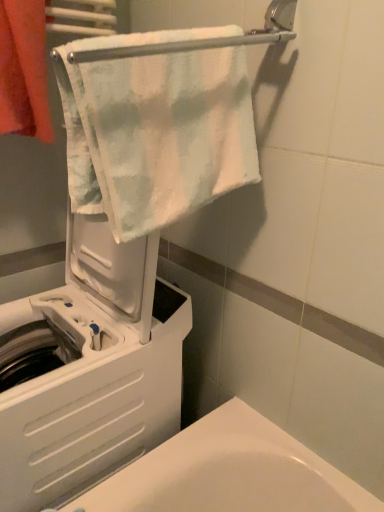
This screenshot has width=384, height=512. What do you see at coordinates (88, 369) in the screenshot?
I see `white plastic washing machine at left` at bounding box center [88, 369].

You are a GUI agent. You are given a task and a screenshot of the screen. Output one action in this format:
    pyautogui.click(x=<x>, y=<y>)
    Task: Click on the white soft towel at upper center, which is the first towel from right to left
    This screenshot has height=512, width=384.
    Given the screenshot: What is the action you would take?
    pyautogui.click(x=156, y=129)

Identify the location of orange cotton towel at upper left, marked as the second towel in a right-to-left arrangement. The width and height of the screenshot is (384, 512). (24, 70).

Relative to orange cotton towel at upper left, positioned as the 1th towel in left-to-right order, is white soft towel at upper center, which is the first towel from right to left, in front or behind?

Visually, white soft towel at upper center, which is the first towel from right to left, is located in front of orange cotton towel at upper left, positioned as the 1th towel in left-to-right order.

Who is smaller, white soft towel at upper center, placed as the second towel when sorted from left to right, or orange cotton towel at upper left, marked as the second towel in a right-to-left arrangement?

Smaller between the two is orange cotton towel at upper left, marked as the second towel in a right-to-left arrangement.

From the image's perspective, does white soft towel at upper center, which is the first towel from right to left, appear lower than orange cotton towel at upper left, positioned as the 1th towel in left-to-right order?

Yes, from the image's perspective, white soft towel at upper center, which is the first towel from right to left, is below orange cotton towel at upper left, positioned as the 1th towel in left-to-right order.

Is white soft towel at upper center, placed as the second towel when sorted from left to right, facing away from white plastic washing machine at left?

Yes, white soft towel at upper center, placed as the second towel when sorted from left to right, is facing away from white plastic washing machine at left.

Is there a large distance between white soft towel at upper center, placed as the second towel when sorted from left to right, and white plastic washing machine at left?

Actually, white soft towel at upper center, placed as the second towel when sorted from left to right, and white plastic washing machine at left are a little close together.

Is white soft towel at upper center, placed as the second towel when sorted from left to right, in front of or behind white plastic washing machine at left in the image?

Clearly, white soft towel at upper center, placed as the second towel when sorted from left to right, is in front of white plastic washing machine at left.

Is orange cotton towel at upper left, marked as the second towel in a right-to-left arrangement, far away from white soft towel at upper center, which is the first towel from right to left?

orange cotton towel at upper left, marked as the second towel in a right-to-left arrangement, is actually quite close to white soft towel at upper center, which is the first towel from right to left.

From a real-world perspective, is orange cotton towel at upper left, marked as the second towel in a right-to-left arrangement, positioned over white soft towel at upper center, which is the first towel from right to left, based on gravity?

Yes, from a real-world perspective, orange cotton towel at upper left, marked as the second towel in a right-to-left arrangement, is on top of white soft towel at upper center, which is the first towel from right to left.

At what (x,y) coordinates should I click in order to perform the action: click on towel above the white soft towel at upper center, which is the first towel from right to left (from a real-world perspective). Please return your answer as a coordinate pair (x, y). Looking at the image, I should click on (24, 70).

Could you tell me if orange cotton towel at upper left, marked as the second towel in a right-to-left arrangement, is facing white plastic washing machine at left?

No, orange cotton towel at upper left, marked as the second towel in a right-to-left arrangement, is not facing towards white plastic washing machine at left.

From the image's perspective, which is above, orange cotton towel at upper left, marked as the second towel in a right-to-left arrangement, or white plastic washing machine at left?

orange cotton towel at upper left, marked as the second towel in a right-to-left arrangement, from the image's perspective.

Based on the photo, which of these two, orange cotton towel at upper left, positioned as the 1th towel in left-to-right order, or white plastic washing machine at left, stands shorter?

orange cotton towel at upper left, positioned as the 1th towel in left-to-right order.

How far apart are orange cotton towel at upper left, positioned as the 1th towel in left-to-right order, and white plastic washing machine at left?

They are 20.18 inches apart.

Between white plastic washing machine at left and white soft towel at upper center, which is the first towel from right to left, which one has larger size?

Bigger between the two is white plastic washing machine at left.

Is white plastic washing machine at left oriented towards white soft towel at upper center, placed as the second towel when sorted from left to right?

No, white plastic washing machine at left is not facing towards white soft towel at upper center, placed as the second towel when sorted from left to right.

Is white plastic washing machine at left completely or partially outside of white soft towel at upper center, which is the first towel from right to left?

Yes, white plastic washing machine at left is located beyond the bounds of white soft towel at upper center, which is the first towel from right to left.

From a real-world perspective, is white plastic washing machine at left beneath white soft towel at upper center, placed as the second towel when sorted from left to right?

Yes, from a real-world perspective, white plastic washing machine at left is below white soft towel at upper center, placed as the second towel when sorted from left to right.

Is point (28, 320) in front of point (29, 127)?

That is False.

Based on the photo, is white plastic washing machine at left outside of orange cotton towel at upper left, positioned as the 1th towel in left-to-right order?

white plastic washing machine at left is positioned outside orange cotton towel at upper left, positioned as the 1th towel in left-to-right order.

Is white plastic washing machine at left bigger or smaller than orange cotton towel at upper left, marked as the second towel in a right-to-left arrangement?

Clearly, white plastic washing machine at left is larger in size than orange cotton towel at upper left, marked as the second towel in a right-to-left arrangement.

The width and height of the screenshot is (384, 512). Identify the location of towel behind the white soft towel at upper center, which is the first towel from right to left. (24, 70).

Locate an element on the screen. towel in front of the white plastic washing machine at left is located at coordinates (156, 129).

When comparing their distances from white soft towel at upper center, placed as the second towel when sorted from left to right, does orange cotton towel at upper left, positioned as the 1th towel in left-to-right order, or white plastic washing machine at left seem further?

white plastic washing machine at left lies further to white soft towel at upper center, placed as the second towel when sorted from left to right, than the other object.

Considering their positions, is white soft towel at upper center, which is the first towel from right to left, positioned further to orange cotton towel at upper left, marked as the second towel in a right-to-left arrangement, than white plastic washing machine at left?

Based on the image, white plastic washing machine at left appears to be further to orange cotton towel at upper left, marked as the second towel in a right-to-left arrangement.

Which object lies nearer to the anchor point white plastic washing machine at left, white soft towel at upper center, placed as the second towel when sorted from left to right, or orange cotton towel at upper left, marked as the second towel in a right-to-left arrangement?

white soft towel at upper center, placed as the second towel when sorted from left to right, is positioned closer to the anchor white plastic washing machine at left.

Considering their positions, is white plastic washing machine at left positioned further to orange cotton towel at upper left, positioned as the 1th towel in left-to-right order, than white soft towel at upper center, placed as the second towel when sorted from left to right?

The object further to orange cotton towel at upper left, positioned as the 1th towel in left-to-right order, is white plastic washing machine at left.

From the image, which object appears to be nearer to white plastic washing machine at left, orange cotton towel at upper left, marked as the second towel in a right-to-left arrangement, or white soft towel at upper center, which is the first towel from right to left?

The object closer to white plastic washing machine at left is white soft towel at upper center, which is the first towel from right to left.

Based on their spatial positions, is white plastic washing machine at left or orange cotton towel at upper left, positioned as the 1th towel in left-to-right order, closer to white soft towel at upper center, placed as the second towel when sorted from left to right?

orange cotton towel at upper left, positioned as the 1th towel in left-to-right order, is positioned closer to the anchor white soft towel at upper center, placed as the second towel when sorted from left to right.

The width and height of the screenshot is (384, 512). I want to click on towel that lies between orange cotton towel at upper left, marked as the second towel in a right-to-left arrangement, and white plastic washing machine at left from top to bottom, so point(156,129).